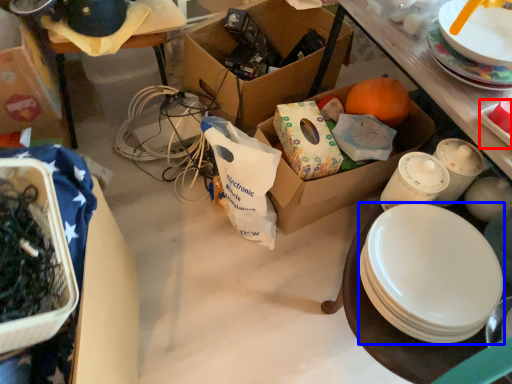
Question: Among these objects, which one is farthest to the camera, platter (highlighted by a red box) or plate (highlighted by a blue box)?

Choices:
 (A) platter
 (B) plate

Answer: (A)